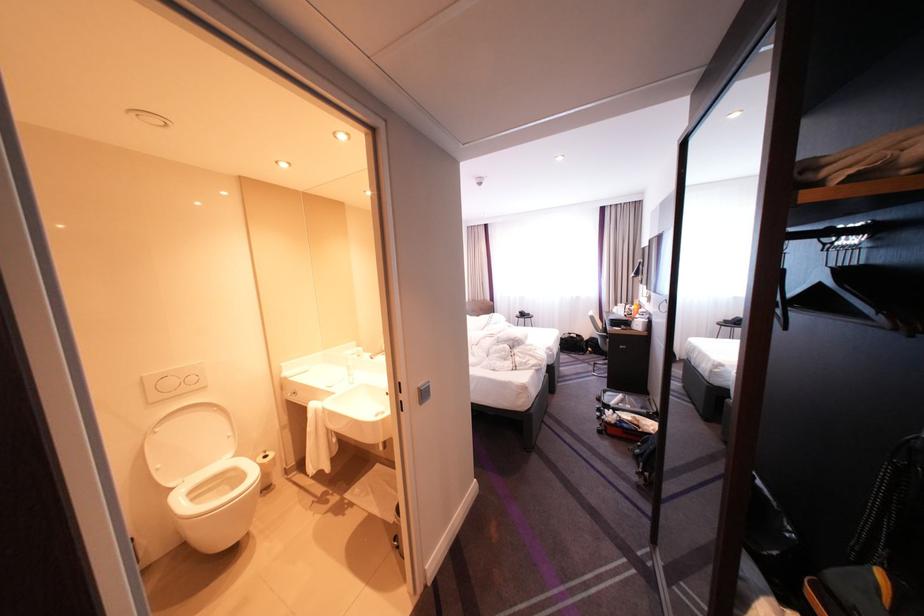
The width and height of the screenshot is (924, 616). I want to click on sink faucet handle, so [x=379, y=360].